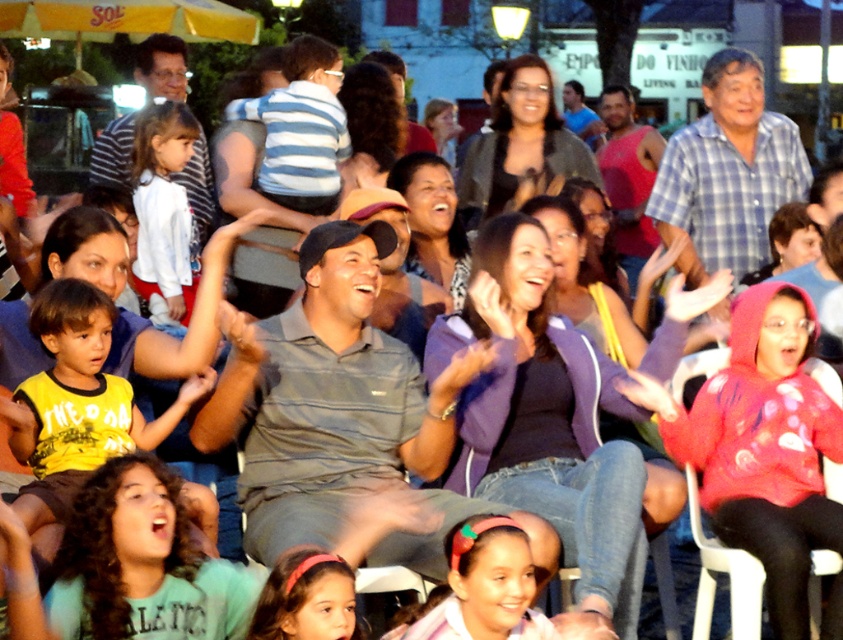
Who is higher up, white cotton shirt at upper left or white plastic chair at lower right?

white cotton shirt at upper left is above.

Between point (173, 268) and point (705, 547), which one is positioned in front?

Point (705, 547)

Does point (148, 145) come closer to viewer compared to point (710, 612)?

That is False.

Image resolution: width=843 pixels, height=640 pixels. In order to click on white cotton shirt at upper left in this screenshot , I will do `click(164, 204)`.

Is yellow matte shirt at lower left wider than white cotton shirt at upper left?

Indeed, yellow matte shirt at lower left has a greater width compared to white cotton shirt at upper left.

Does yellow matte shirt at lower left have a lesser height compared to white cotton shirt at upper left?

Yes, yellow matte shirt at lower left is shorter than white cotton shirt at upper left.

This screenshot has height=640, width=843. What do you see at coordinates (78, 401) in the screenshot?
I see `yellow matte shirt at lower left` at bounding box center [78, 401].

Identify the location of yellow matte shirt at lower left. (78, 401).

Is point (30, 456) in front of point (702, 556)?

Yes.

Between yellow matte shirt at lower left and white plastic chair at lower right, which one appears on the right side from the viewer's perspective?

Positioned to the right is white plastic chair at lower right.

Identify the location of yellow matte shirt at lower left. The image size is (843, 640). (78, 401).